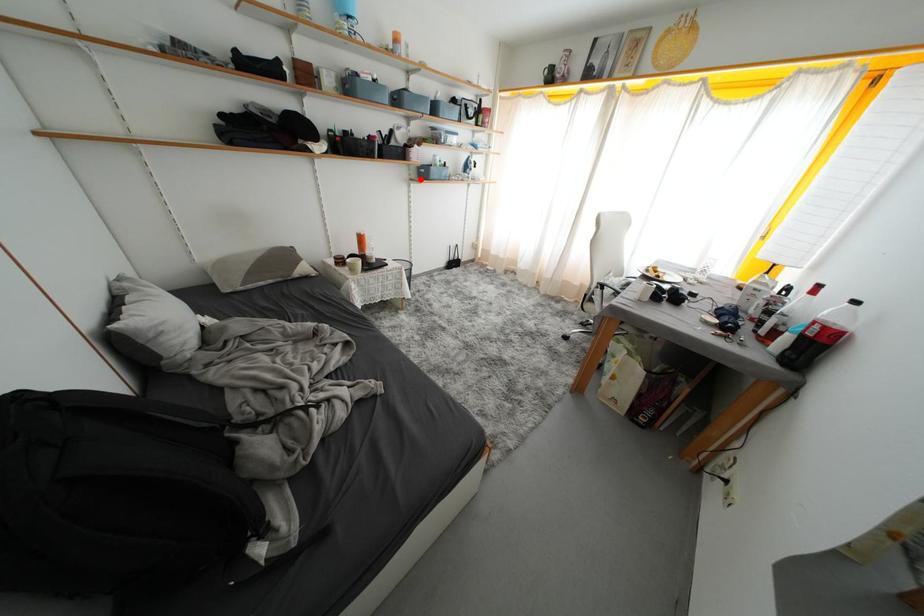
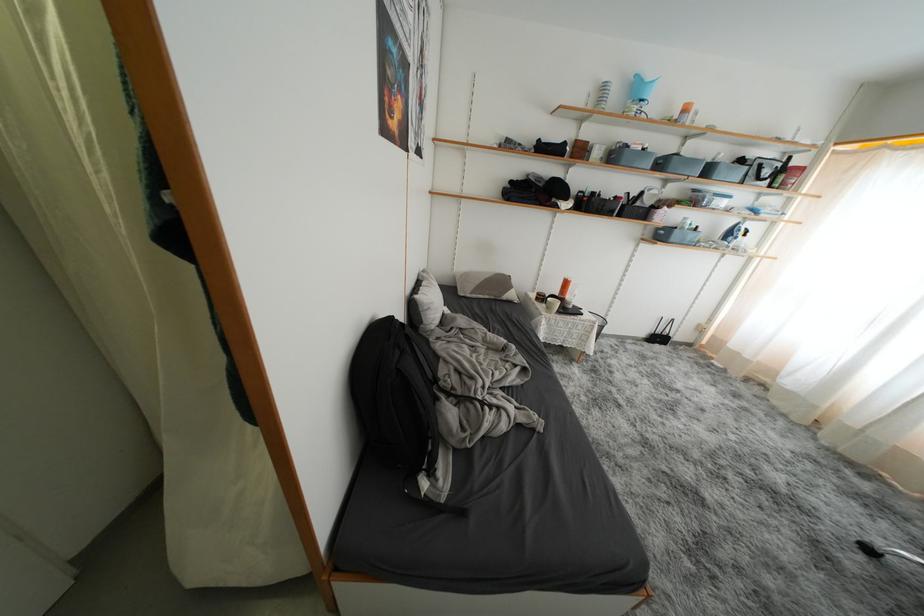
Question: I am providing you with two images of the same scene from different viewpoints. A red point is marked on the first image. Can you still see the location of the red point in image 2?

Choices:
 (A) Yes
 (B) No

Answer: (A)